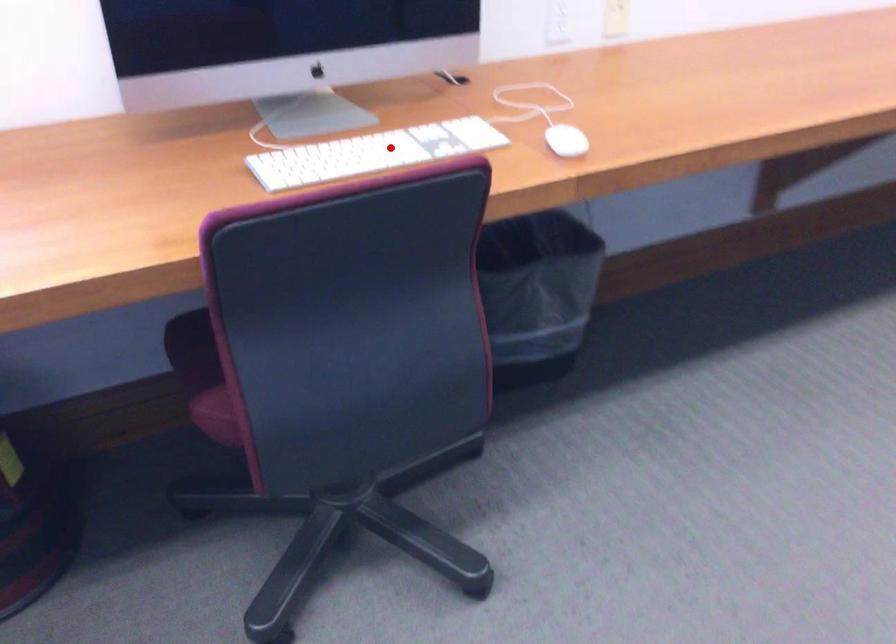
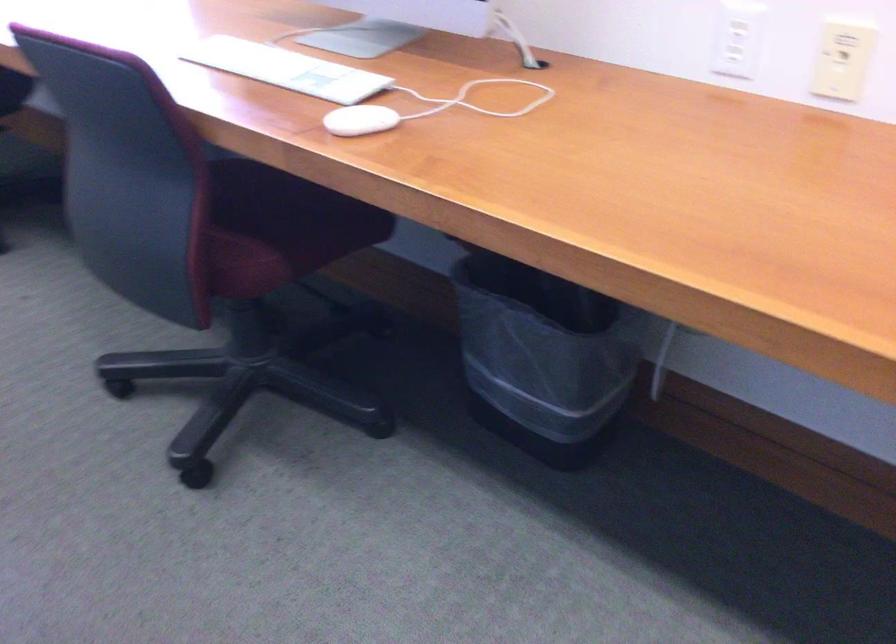
Find the pixel in the second image that matches the highlighted location in the first image.

(286, 69)